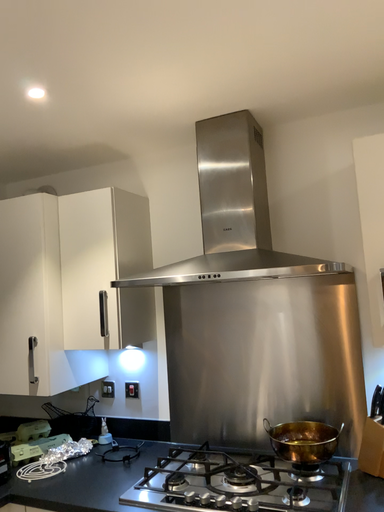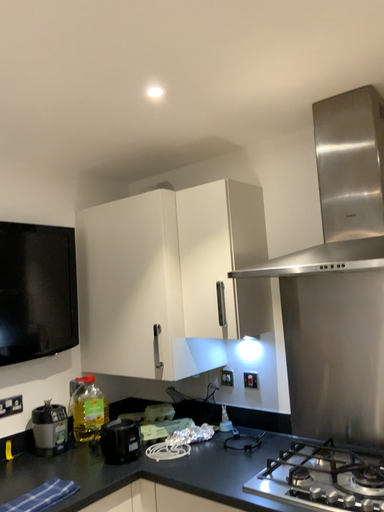
Question: Which way did the camera rotate in the video?

Choices:
 (A) rotated right
 (B) rotated left

Answer: (B)